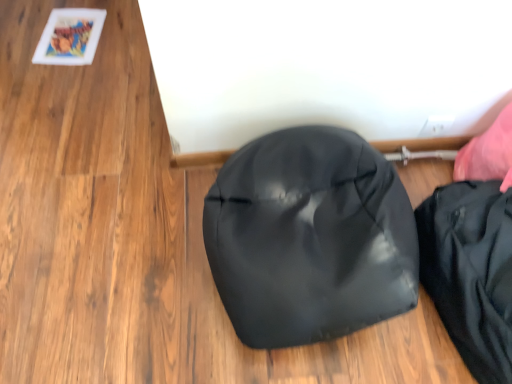
Where is `vacant space situated on the left part of matte black shoe at center`? Image resolution: width=512 pixels, height=384 pixels. vacant space situated on the left part of matte black shoe at center is located at coordinates (128, 244).